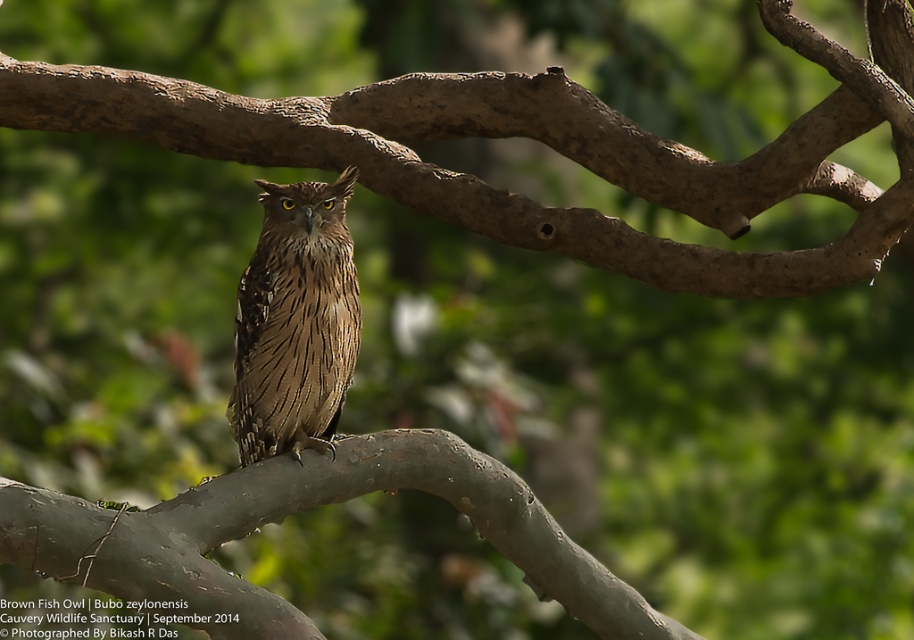
You are a birdwatcher trying to identify the owl species in the image. The scene shows a brown feathered owl at center perched on a brown matte branch at center. Which object is wider in this scene?

The brown matte branch at center is wider than the brown feathered owl at center.

You are an ornithologist observing the Brown Fish Owl perched on the branches. You notice two branches at the center of the image. Which branch, the brown wood tree branch at center or the brown matte branch at center, is taller?

The brown wood tree branch at center is much taller than the brown matte branch at center.

You are standing 3 meters away from the Brown Fish Owl perched on the tree branch. You want to take a photo of the owl without moving. Is the point at coordinates point (877, 65) within your current viewing range?

The point at coordinates point (877, 65) is 3.25 meters away from the viewer, which is slightly beyond the 3 meters distance you are standing from the Brown Fish Owl. Therefore, the point is outside your current viewing range.